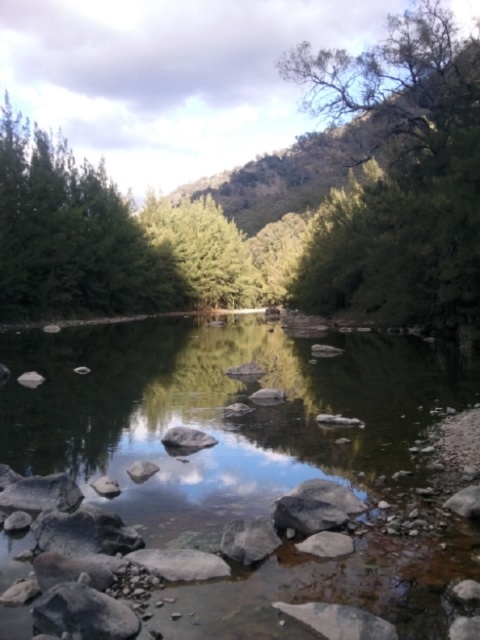
Question: Does smooth rock stream at center come in front of green matte tree at center?

Choices:
 (A) yes
 (B) no

Answer: (A)

Question: From the image, what is the correct spatial relationship of green leafy tree at left in relation to smooth gray rock at center?

Choices:
 (A) left
 (B) right

Answer: (A)

Question: Which point appears closest to the camera in this image?

Choices:
 (A) (184, 280)
 (B) (229, 522)
 (C) (250, 499)

Answer: (B)

Question: Which point is farther from the camera taking this photo?

Choices:
 (A) (261, 524)
 (B) (189, 228)
 (C) (411, 433)

Answer: (B)

Question: Can you confirm if green leafy tree at left is smaller than smooth gray rock at center?

Choices:
 (A) no
 (B) yes

Answer: (A)

Question: Which point appears closest to the camera in this image?

Choices:
 (A) (242, 563)
 (B) (140, 209)
 (C) (16, 220)

Answer: (A)